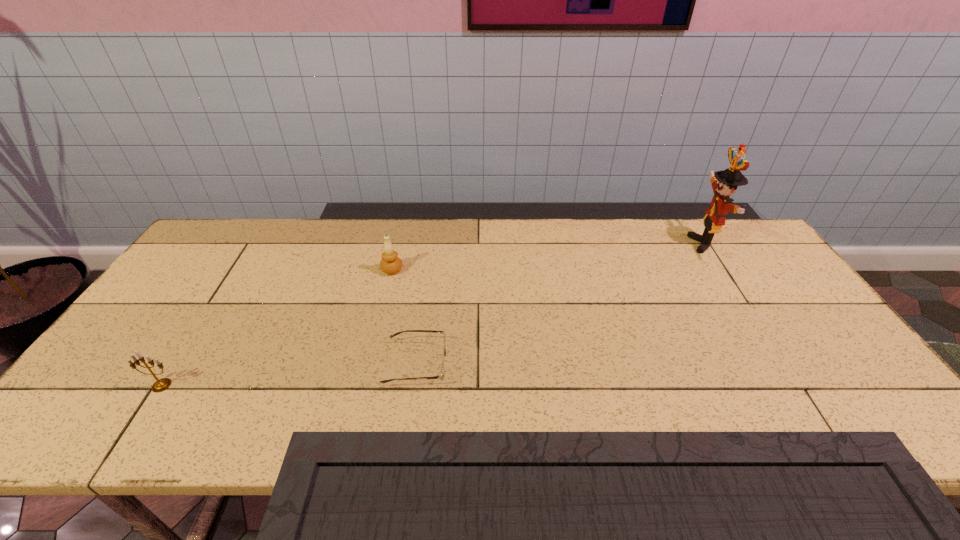
Where is `blank space at the near edge of the desktop`? This screenshot has height=540, width=960. blank space at the near edge of the desktop is located at coordinates (170, 424).

This screenshot has height=540, width=960. I want to click on vacant space at the left edge of the desktop, so click(179, 301).

Where is `vacant space at the far left corner of the desktop`? The image size is (960, 540). vacant space at the far left corner of the desktop is located at coordinates 201,246.

This screenshot has height=540, width=960. In order to click on free location at the near left corner in this screenshot , I will do `click(81, 424)`.

Locate an element on the screen. This screenshot has height=540, width=960. free space between the shortest object and the tallest object is located at coordinates (561, 304).

Find the location of a particular element. The image size is (960, 540). free space that is in between the spectacles and the right candelabrum is located at coordinates (404, 317).

Where is `empty location between the third object from left to right and the leftmost object`? This screenshot has width=960, height=540. empty location between the third object from left to right and the leftmost object is located at coordinates (289, 375).

The image size is (960, 540). Find the location of `free area in between the tallest object and the shortest object`. free area in between the tallest object and the shortest object is located at coordinates (561, 304).

At what (x,y) coordinates should I click in order to perform the action: click on free spot between the leftmost object and the nutcracker. Please return your answer as a coordinate pair (x, y). Looking at the image, I should click on (433, 315).

The height and width of the screenshot is (540, 960). Identify the location of unoccupied area between the nutcracker and the nearer candelabrum. (433, 315).